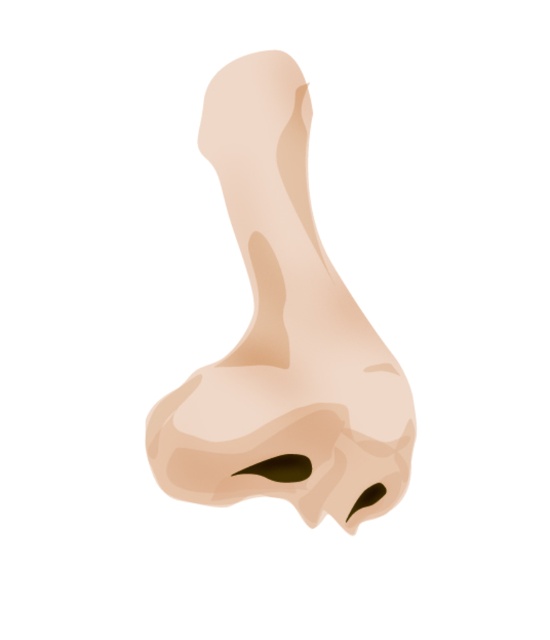
Is matte beige nose at center bigger than black matte nostril at center?

Yes, matte beige nose at center is bigger than black matte nostril at center.

Does matte beige nose at center appear on the right side of black matte nostril at center?

Incorrect, matte beige nose at center is not on the right side of black matte nostril at center.

Does point (306, 86) come farther from viewer compared to point (371, 490)?

Yes.

Locate an element on the screen. matte beige nose at center is located at coordinates (283, 332).

Does matte black nostril at center appear over black matte nostril at center?

Indeed, matte black nostril at center is positioned over black matte nostril at center.

Who is taller, matte black nostril at center or black matte nostril at center?

black matte nostril at center

Which is in front, point (299, 481) or point (370, 499)?

Point (299, 481)

This screenshot has width=550, height=640. Find the location of `matte black nostril at center`. matte black nostril at center is located at coordinates (280, 467).

Between point (162, 449) and point (270, 467), which one is positioned behind?

Point (270, 467)

Which is below, matte beige nose at center or matte black nostril at center?

matte black nostril at center is lower down.

Who is more forward, (266, 486) or (235, 474)?

Point (235, 474) is more forward.

Locate an element on the screen. This screenshot has width=550, height=640. matte beige nose at center is located at coordinates (283, 332).